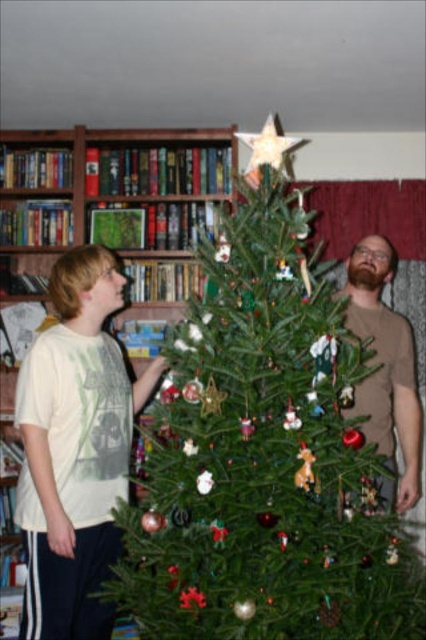
You are standing in front of the Christmas tree and want to place a new ornament at one of the two points marked. The points are labeled as point 1 at coordinates point (81, 195) and point 2 at coordinates point (109, 289). If you want to place the ornament closer to the young person who is on the left side of the tree, which point should you choose?

Point 2 at coordinates point (109, 289) is closer to the young person who is on the left side of the tree because point 1 is behind point 2, meaning it is farther away from the young person.